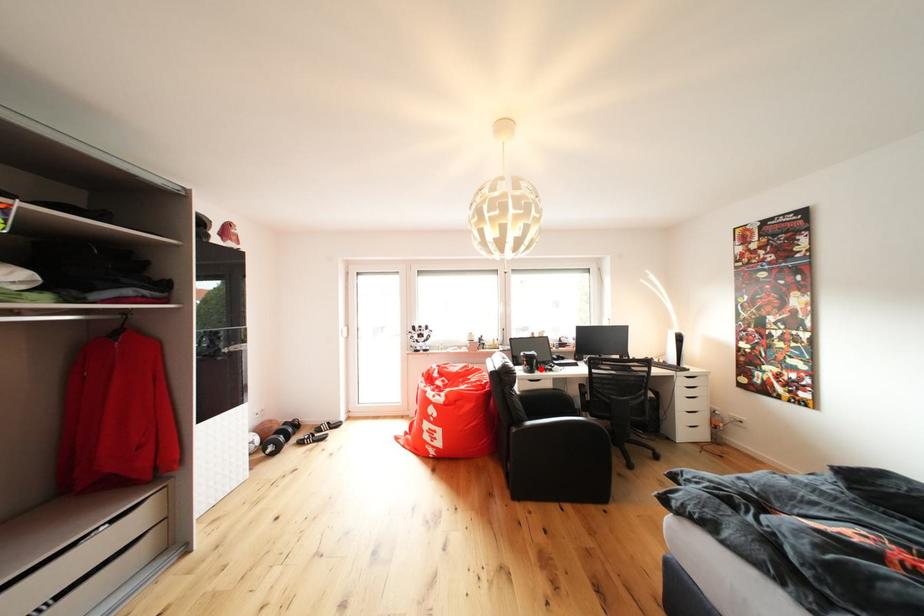
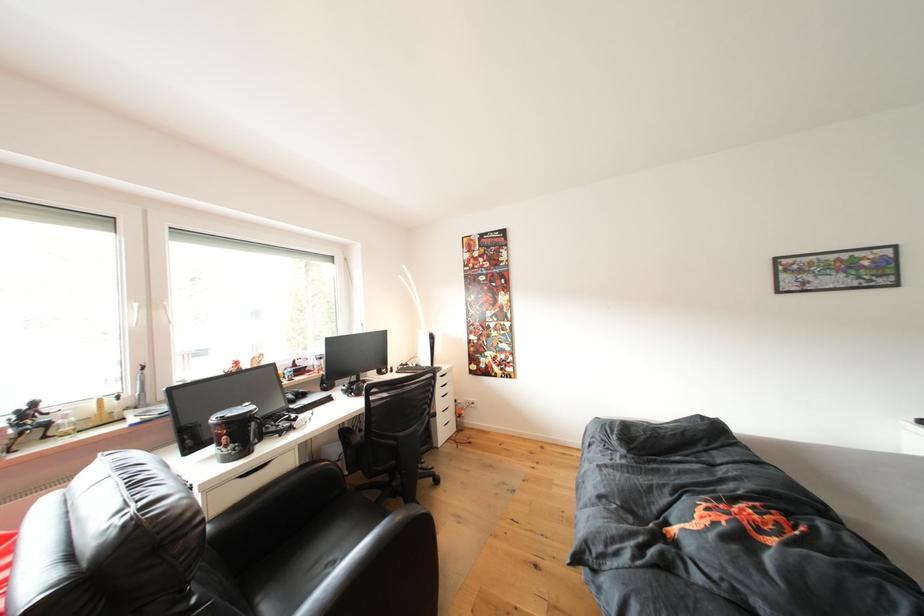
Question: A red point is marked in image1. In image2, is the corresponding 3D point closer to the camera or farther? Reply with the corresponding letter.

Choices:
 (A) The corresponding 3D point is closer.
 (B) The corresponding 3D point is farther.

Answer: (A)